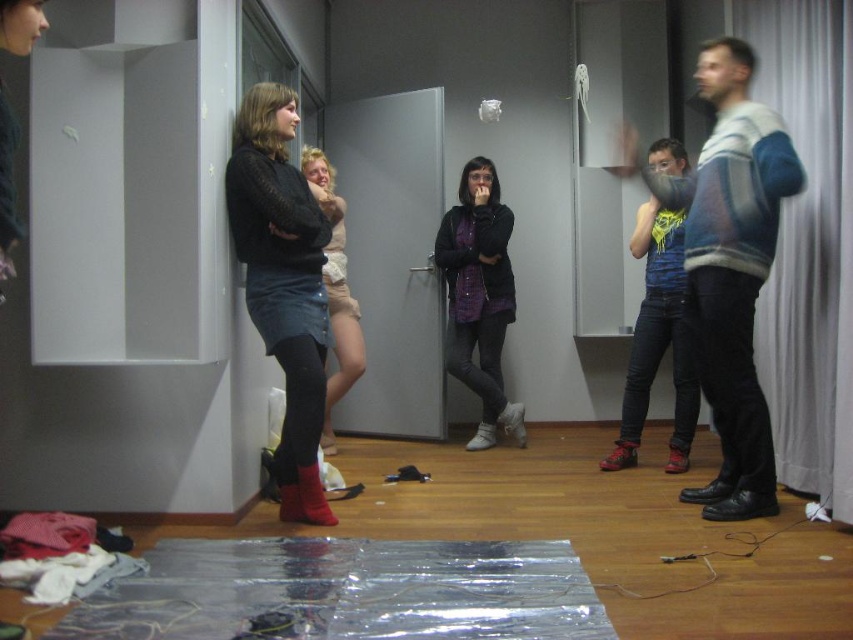
You are organizing a small party in the room and need to decide where to place a new decorative item. The white fabric curtain at right and the leather boot at lower center are already present. Which object is located more to the right side of the room?

The white fabric curtain at right is positioned on the right side of the leather boot at lower center, so it is located more to the right side of the room.

You are organizing a fashion show and need to arrange the denim skirt at center and the white suede boot at center in a display. According to the image, which item should be placed to the left of the other?

The denim skirt at center should be placed to the left of the white suede boot at center because the denim skirt at center is positioned on the left side of white suede boot at center in the image.